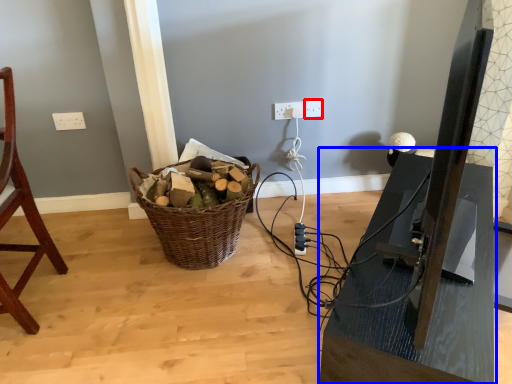
Question: Which object is closer to the camera taking this photo, electric outlet (highlighted by a red box) or table (highlighted by a blue box)?

Choices:
 (A) electric outlet
 (B) table

Answer: (B)